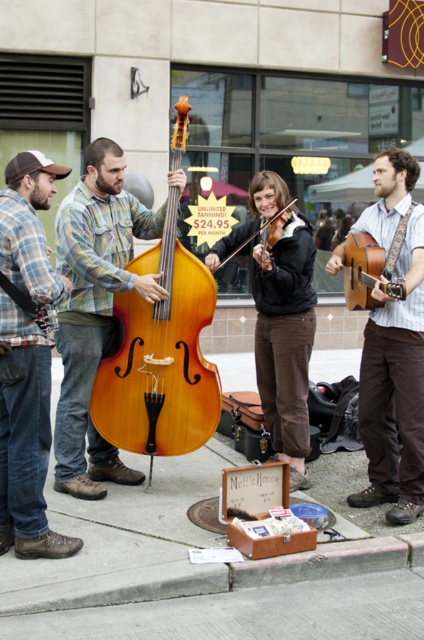
The width and height of the screenshot is (424, 640). What do you see at coordinates (94, 308) in the screenshot?
I see `matte plaid shirt at center` at bounding box center [94, 308].

Between point (74, 403) and point (206, 403), which one is positioned in front?

Positioned in front is point (74, 403).

The height and width of the screenshot is (640, 424). In order to click on matte plaid shirt at center in this screenshot , I will do `click(94, 308)`.

Does matte plaid shirt at center have a smaller size compared to shiny brown violin at center?

Actually, matte plaid shirt at center might be larger than shiny brown violin at center.

Is point (161, 212) farther from viewer compared to point (228, 257)?

No, (161, 212) is in front of (228, 257).

The width and height of the screenshot is (424, 640). I want to click on matte plaid shirt at center, so click(94, 308).

Is point (83, 568) in front of point (396, 499)?

That is True.

Which is above, wooden suitcase at center or striped cotton shirt at center?

Positioned higher is striped cotton shirt at center.

Which is behind, point (236, 621) or point (381, 388)?

The point (381, 388) is more distant.

Locate an element on the screen. The image size is (424, 640). wooden suitcase at center is located at coordinates (206, 570).